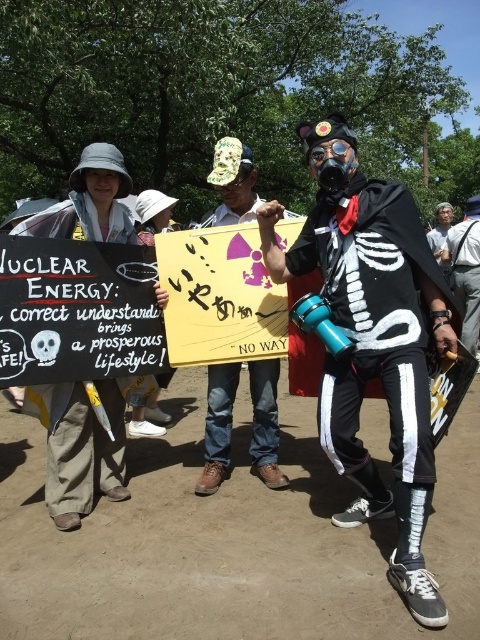
You are a photographer trying to capture a group photo of the black matte skeleton costume at center and the white cotton shirt at center. If you want to ensure both are fully visible in the frame without cropping, which one requires more horizontal space due to their size?

The black matte skeleton costume at center requires more horizontal space because its width surpasses that of the white cotton shirt at center.

You are a photographer trying to capture a group photo of the black matte skeleton costume at center and the white cotton shirt at center. Which one should you focus on first to ensure they are both in frame?

The black matte skeleton costume at center is much taller than the white cotton shirt at center, so you should focus on the black matte skeleton costume at center first to ensure both are in frame.